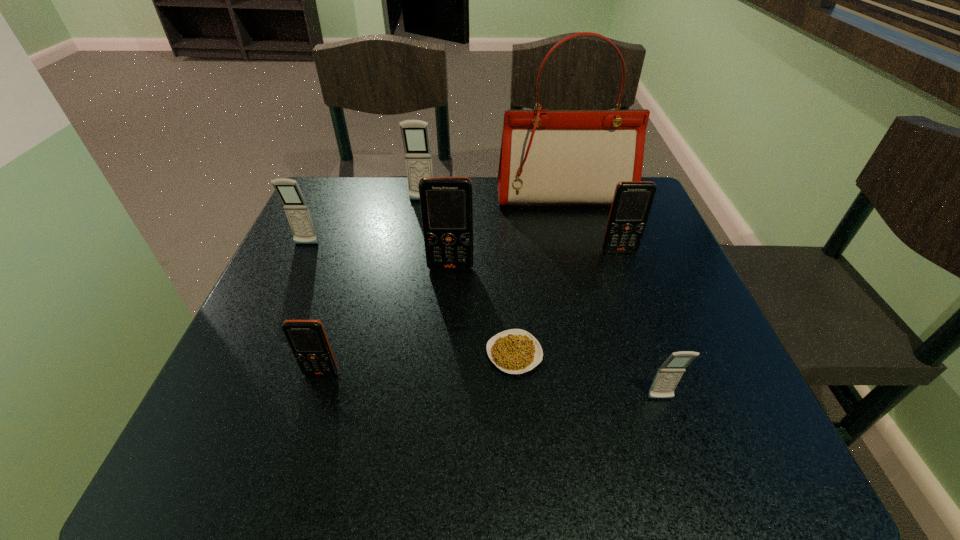
Find the location of a particular element. The width and height of the screenshot is (960, 540). vacant space located on the screen of the nearest orange cellular telephone is located at coordinates (289, 477).

The height and width of the screenshot is (540, 960). I want to click on free region located 0.090m on the front-facing side of the nearest cellular telephone, so click(681, 457).

Where is `vacant space situated 0.360m on the back of the legume`? The width and height of the screenshot is (960, 540). vacant space situated 0.360m on the back of the legume is located at coordinates (505, 220).

Where is `handbag at the far edge`? This screenshot has height=540, width=960. handbag at the far edge is located at coordinates (548, 157).

Image resolution: width=960 pixels, height=540 pixels. Identify the location of cellular telephone that is at the far edge. 415,134.

The width and height of the screenshot is (960, 540). Identify the location of handbag located at the right edge. (548, 157).

In order to click on object that is at the far right corner in this screenshot , I will do `click(548, 157)`.

Identify the location of vacant space at the far edge of the desktop. This screenshot has width=960, height=540. (450, 176).

Locate an element on the screen. The width and height of the screenshot is (960, 540). vacant space at the near edge of the desktop is located at coordinates click(x=519, y=421).

At what (x,y) coordinates should I click in order to perform the action: click on free space at the left edge of the desktop. Please return your answer as a coordinate pair (x, y). Looking at the image, I should click on (208, 418).